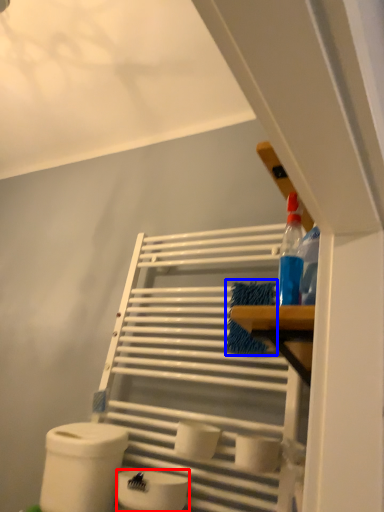
Question: Among these objects, which one is farthest to the camera, toilet paper (highlighted by a red box) or material (highlighted by a blue box)?

Choices:
 (A) toilet paper
 (B) material

Answer: (B)